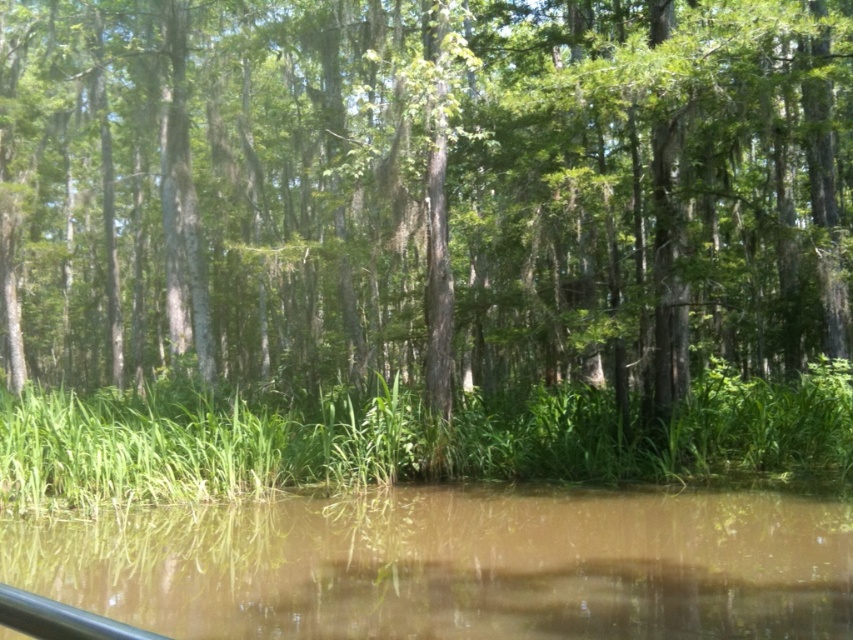
Between green matte tree at center and black rubber rail at lower left, which one has more height?

green matte tree at center

From the picture: Who is positioned more to the right, green matte tree at center or black rubber rail at lower left?

black rubber rail at lower left is more to the right.

The width and height of the screenshot is (853, 640). In order to click on green matte tree at center in this screenshot , I will do `click(424, 189)`.

You are a GUI agent. You are given a task and a screenshot of the screen. Output one action in this format:
    pyautogui.click(x=<x>, y=<y>)
    Task: Click on the green matte tree at center
    The width and height of the screenshot is (853, 640).
    Given the screenshot: What is the action you would take?
    pyautogui.click(x=424, y=189)

Does brown muddy water at lower center come in front of black rubber rail at lower left?

No.

Can you confirm if brown muddy water at lower center is positioned to the left of black rubber rail at lower left?

No, brown muddy water at lower center is not to the left of black rubber rail at lower left.

Does point (285, 604) lie in front of point (103, 630)?

No, it is behind (103, 630).

Where is `brown muddy water at lower center`? The width and height of the screenshot is (853, 640). brown muddy water at lower center is located at coordinates (454, 564).

Is green matte tree at center smaller than brown muddy water at lower center?

Incorrect, green matte tree at center is not smaller in size than brown muddy water at lower center.

Looking at this image, who is more forward, (335, 304) or (727, 540)?

Point (727, 540) is more forward.

The image size is (853, 640). I want to click on green matte tree at center, so click(x=424, y=189).